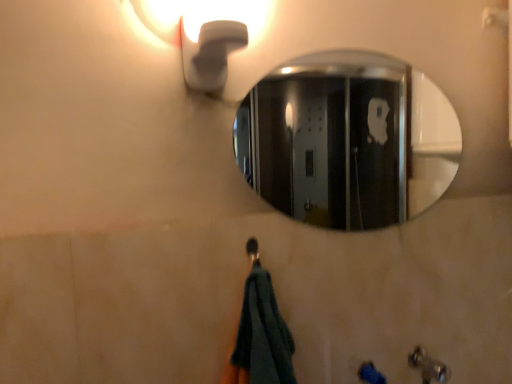
The width and height of the screenshot is (512, 384). What do you see at coordinates (428, 366) in the screenshot? I see `metallic silver faucet at lower right` at bounding box center [428, 366].

The height and width of the screenshot is (384, 512). Describe the element at coordinates (205, 33) in the screenshot. I see `white matte light fixture at upper left` at that location.

The image size is (512, 384). Describe the element at coordinates (347, 140) in the screenshot. I see `polished chrome mirror at upper center` at that location.

Locate an element on the screen. The height and width of the screenshot is (384, 512). metallic silver faucet at lower right is located at coordinates (428, 366).

Is white matte light fixture at upper left spatially inside polished chrome mirror at upper center, or outside of it?

white matte light fixture at upper left is outside polished chrome mirror at upper center.

In terms of height, does white matte light fixture at upper left look taller or shorter compared to polished chrome mirror at upper center?

In the image, white matte light fixture at upper left appears to be shorter than polished chrome mirror at upper center.

How distant is white matte light fixture at upper left from polished chrome mirror at upper center?

white matte light fixture at upper left and polished chrome mirror at upper center are 3.52 feet apart from each other.

What's the angular difference between white matte light fixture at upper left and polished chrome mirror at upper center's facing directions?

white matte light fixture at upper left and polished chrome mirror at upper center are facing 0.59 degrees away from each other.

Is polished chrome mirror at upper center thinner than white matte light fixture at upper left?

Indeed, polished chrome mirror at upper center has a lesser width compared to white matte light fixture at upper left.

Between polished chrome mirror at upper center and white matte light fixture at upper left, which one appears on the left side from the viewer's perspective?

white matte light fixture at upper left is more to the left.

From a real-world perspective, which is physically above, polished chrome mirror at upper center or white matte light fixture at upper left?

white matte light fixture at upper left, from a real-world perspective.

Considering the positions of point (336, 162) and point (196, 12), is point (336, 162) closer or farther from the camera than point (196, 12)?

Clearly, point (336, 162) is more distant from the camera than point (196, 12).

Does metallic silver faucet at lower right have a greater height compared to polished chrome mirror at upper center?

Incorrect, the height of metallic silver faucet at lower right is not larger of that of polished chrome mirror at upper center.

Which object is further away from the camera, metallic silver faucet at lower right or polished chrome mirror at upper center?

polished chrome mirror at upper center is further from the camera.

Can you confirm if polished chrome mirror at upper center is positioned to the left of metallic silver faucet at lower right?

Yes.

Is point (326, 129) closer or farther from the camera than point (432, 361)?

Point (326, 129) appears to be farther away from the viewer than point (432, 361).

Does polished chrome mirror at upper center turn towards metallic silver faucet at lower right?

No, polished chrome mirror at upper center is not facing towards metallic silver faucet at lower right.

Can you confirm if polished chrome mirror at upper center is smaller than metallic silver faucet at lower right?

Indeed, polished chrome mirror at upper center has a smaller size compared to metallic silver faucet at lower right.

From the image's perspective, is white matte light fixture at upper left on metallic silver faucet at lower right?

Indeed, from the image's perspective, white matte light fixture at upper left is shown above metallic silver faucet at lower right.

Is white matte light fixture at upper left thinner than metallic silver faucet at lower right?

Correct, the width of white matte light fixture at upper left is less than that of metallic silver faucet at lower right.

Is metallic silver faucet at lower right inside the boundaries of white matte light fixture at upper left, or outside?

metallic silver faucet at lower right lies outside white matte light fixture at upper left.

Is metallic silver faucet at lower right oriented towards white matte light fixture at upper left?

No.

In the scene shown: Is metallic silver faucet at lower right to the left or to the right of white matte light fixture at upper left in the image?

metallic silver faucet at lower right is positioned on white matte light fixture at upper left's right side.

Is metallic silver faucet at lower right taller or shorter than white matte light fixture at upper left?

In the image, metallic silver faucet at lower right appears to be shorter than white matte light fixture at upper left.

The width and height of the screenshot is (512, 384). What are the coordinates of `light fixture that appears above the polished chrome mirror at upper center (from the image's perspective)` in the screenshot? It's located at (205, 33).

Locate an element on the screen. The width and height of the screenshot is (512, 384). mirror on the right of the white matte light fixture at upper left is located at coordinates (347, 140).

Looking at the image, which one is located further to white matte light fixture at upper left, polished chrome mirror at upper center or metallic silver faucet at lower right?

polished chrome mirror at upper center is positioned further to the anchor white matte light fixture at upper left.

Considering their positions, is white matte light fixture at upper left positioned further to metallic silver faucet at lower right than polished chrome mirror at upper center?

polished chrome mirror at upper center.

In the scene shown: Which object lies nearer to the anchor point metallic silver faucet at lower right, polished chrome mirror at upper center or white matte light fixture at upper left?

Among the two, white matte light fixture at upper left is located nearer to metallic silver faucet at lower right.

Looking at the image, which one is located further to white matte light fixture at upper left, metallic silver faucet at lower right or polished chrome mirror at upper center?

The object further to white matte light fixture at upper left is polished chrome mirror at upper center.

From the image, which object appears to be farther from polished chrome mirror at upper center, white matte light fixture at upper left or metallic silver faucet at lower right?

The object further to polished chrome mirror at upper center is metallic silver faucet at lower right.

When comparing their distances from polished chrome mirror at upper center, does metallic silver faucet at lower right or white matte light fixture at upper left seem further?

metallic silver faucet at lower right.

Locate an element on the screen. Image resolution: width=512 pixels, height=384 pixels. mirror between white matte light fixture at upper left and metallic silver faucet at lower right from top to bottom is located at coordinates (347, 140).